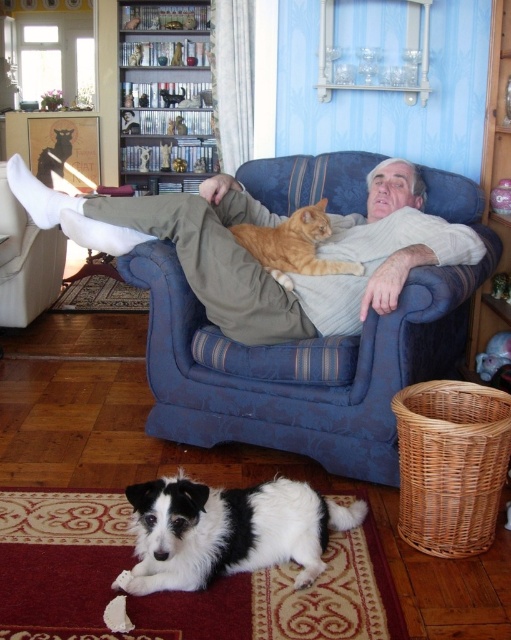
You are a small toy that is 10 cm tall. You want to move from the floor to the blue fabric couch at center. Can you climb onto it from the white knit sweater at center?

The blue fabric couch at center is taller than the white knit sweater at center. Since the toy is only 10 cm tall, it may struggle to climb the height difference between the two objects.